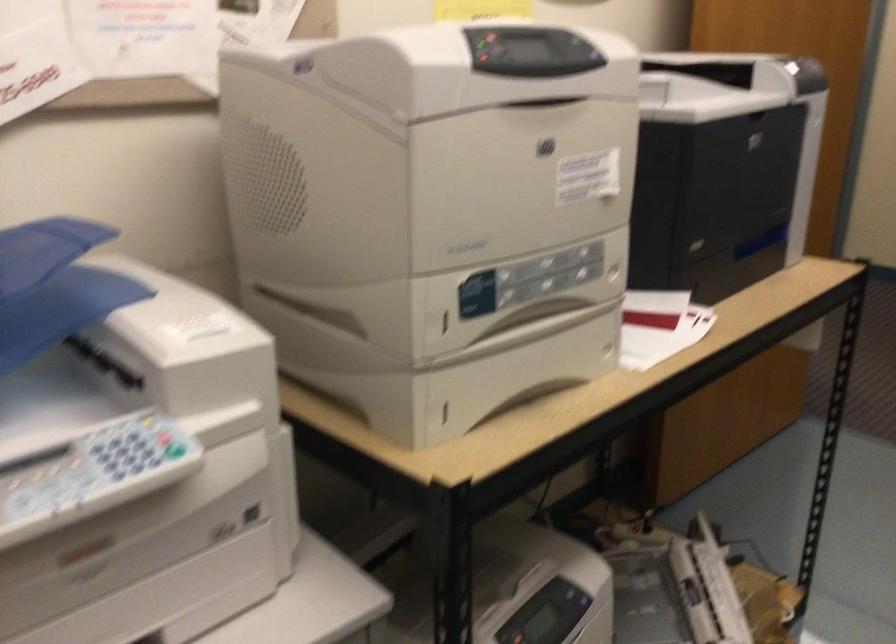
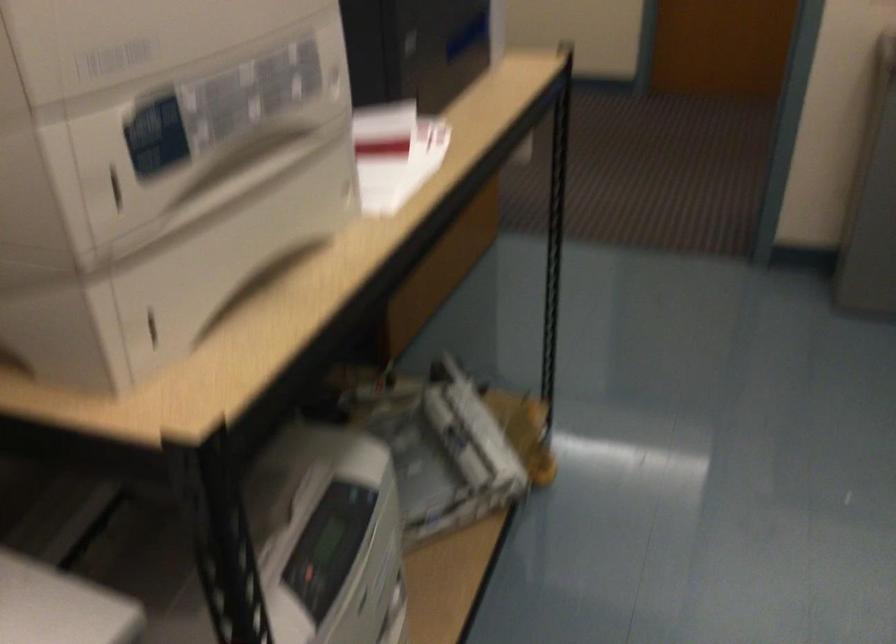
Question: The images are taken continuously from a first-person perspective. In which direction is your viewpoint rotating?

Choices:
 (A) Left
 (B) Right
 (C) Up
 (D) Down

Answer: (B)